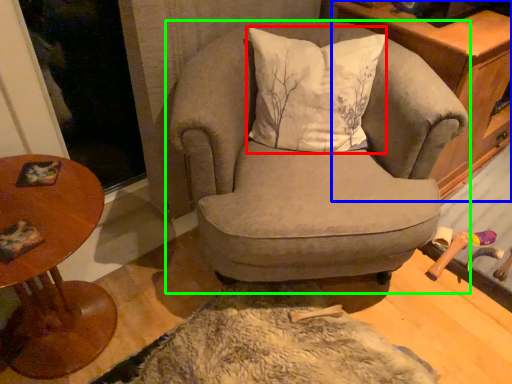
Question: Based on their relative distances, which object is farther from pillow (highlighted by a red box)? Choose from cabinetry (highlighted by a blue box) and chair (highlighted by a green box).

Choices:
 (A) cabinetry
 (B) chair

Answer: (A)